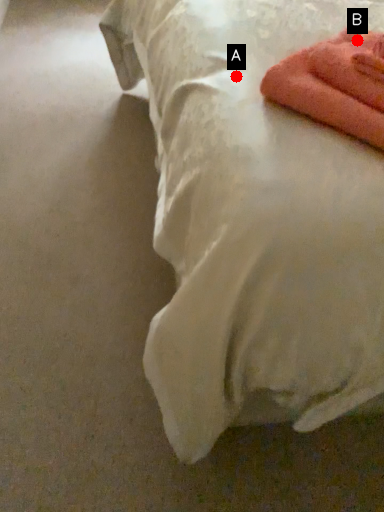
Question: Two points are circled on the image, labeled by A and B beside each circle. Among these points, which one is farthest from the camera?

Choices:
 (A) A is further
 (B) B is further

Answer: (A)